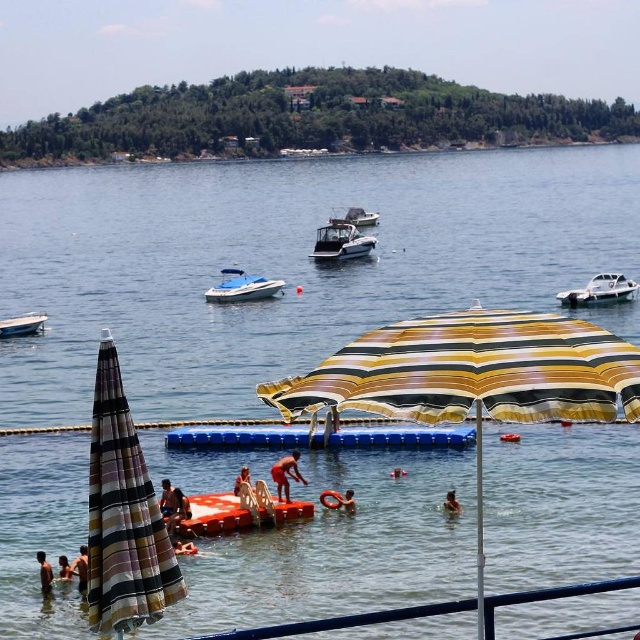
Question: Is white glossy boat at right positioned before skinny man at lower left?

Choices:
 (A) yes
 (B) no

Answer: (B)

Question: From the image, what is the correct spatial relationship of white plastic boat at center in relation to skinny person at lower left?

Choices:
 (A) above
 (B) below

Answer: (A)

Question: Which object appears farthest from the camera in this image?

Choices:
 (A) white glossy boat at center
 (B) brown skin at lower center

Answer: (A)

Question: Which of these objects is positioned farthest from the white glossy boat at right?

Choices:
 (A) yellow striped umbrella at center
 (B) skinny man at lower left
 (C) brown skin at lower center

Answer: (B)

Question: Which point is closer to the camera?

Choices:
 (A) (388, 328)
 (B) (356, 250)
 (C) (61, 570)
 (D) (356, 225)

Answer: (A)

Question: Does white glossy boat at right appear over tan skin human at lower left?

Choices:
 (A) yes
 (B) no

Answer: (A)